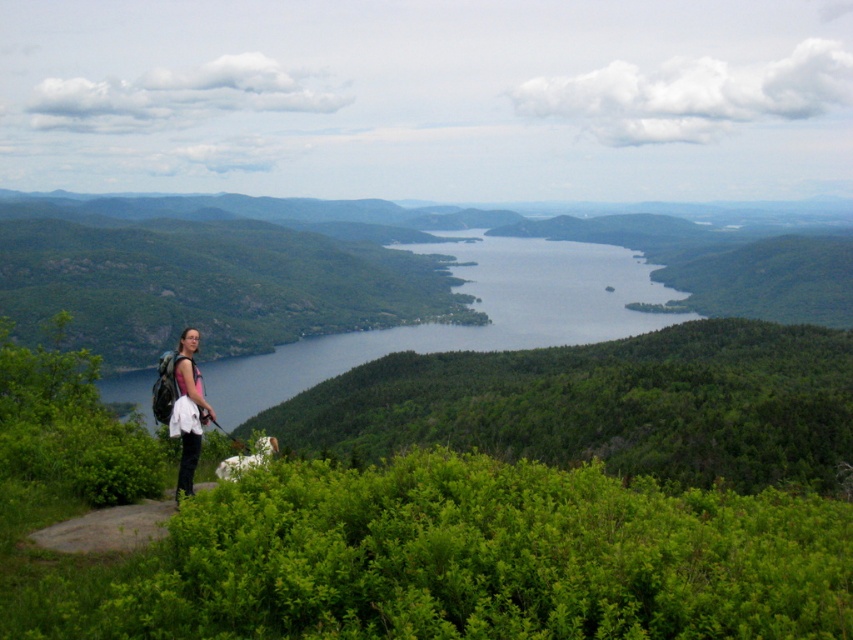
Question: Which point is closer to the camera?

Choices:
 (A) (618, 317)
 (B) (183, 449)

Answer: (B)

Question: Which object appears farthest from the camera in this image?

Choices:
 (A) matte pink shirt at left
 (B) green grassy hillside at lower left

Answer: (B)

Question: Is green grassy hillside at lower left further to camera compared to matte pink shirt at left?

Choices:
 (A) yes
 (B) no

Answer: (A)

Question: Can you confirm if green grassy hillside at lower left is positioned to the right of matte pink shirt at left?

Choices:
 (A) no
 (B) yes

Answer: (B)

Question: Which of the following is the closest to the observer?

Choices:
 (A) (612, 256)
 (B) (200, 381)

Answer: (B)

Question: Does green grassy hillside at lower left lie in front of matte pink shirt at left?

Choices:
 (A) yes
 (B) no

Answer: (B)